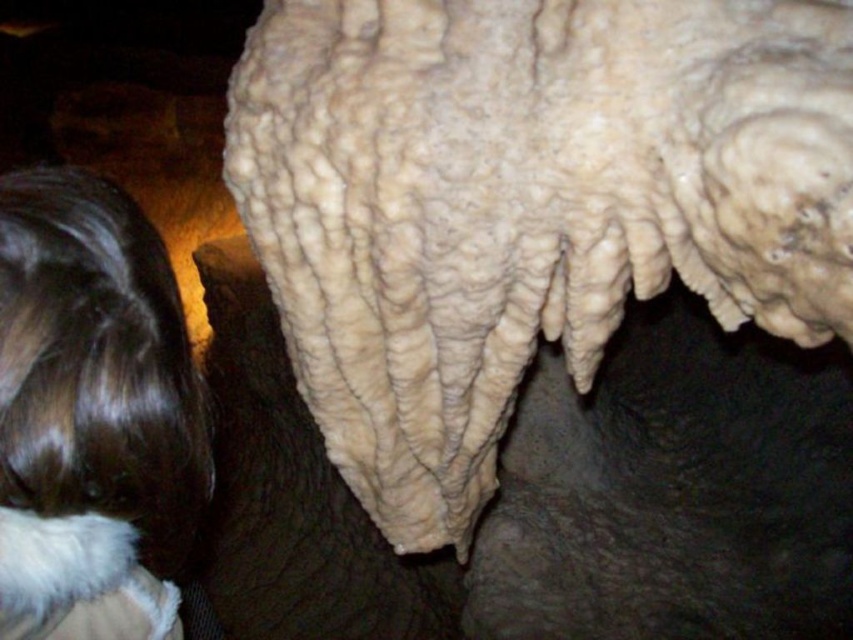
Can you confirm if white textured rock at center is bigger than brown hair at upper left?

Yes.

Does white textured rock at center appear on the left side of brown hair at upper left?

No, white textured rock at center is not to the left of brown hair at upper left.

Measure the distance between point (456, 308) and camera.

Point (456, 308) and camera are 1.75 meters apart.

Identify the location of white textured rock at center. (525, 204).